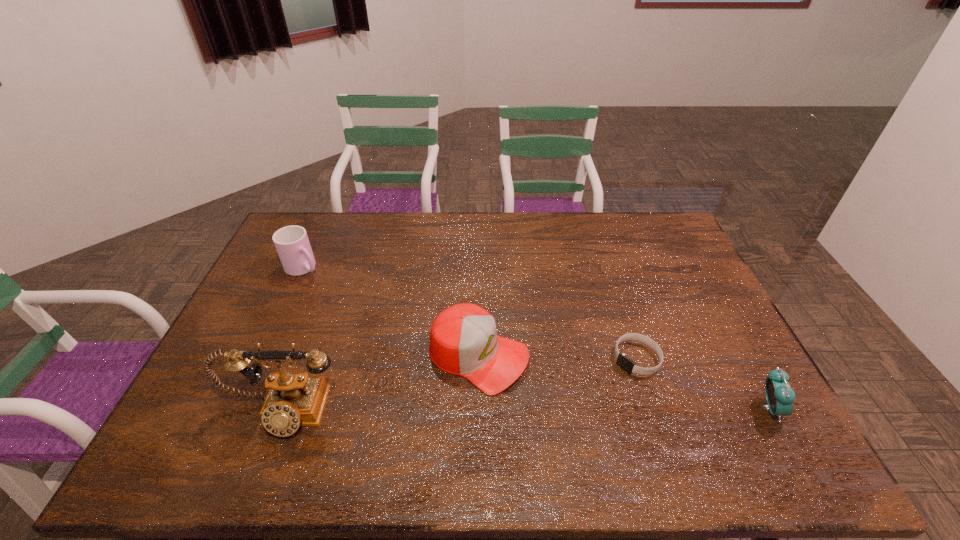
This screenshot has height=540, width=960. I want to click on free space located on the outer surface of the wristband, so click(598, 390).

Identify the location of vacant space located on the outer surface of the wristband. (564, 419).

In order to click on free space located 0.180m on the front-facing side of the baseball cap in this screenshot , I will do `click(587, 409)`.

You are a GUI agent. You are given a task and a screenshot of the screen. Output one action in this format:
    pyautogui.click(x=<x>, y=<y>)
    Task: Click on the vacant space located on the front-facing side of the baseball cap
    
    Given the screenshot: What is the action you would take?
    pyautogui.click(x=598, y=415)

At what (x,y) coordinates should I click in order to perform the action: click on vacant space located 0.220m on the front-facing side of the baseball cap. Please return your answer as a coordinate pair (x, y). The image size is (960, 540). Looking at the image, I should click on (602, 417).

Locate an element on the screen. Image resolution: width=960 pixels, height=540 pixels. telephone present at the near edge is located at coordinates (295, 399).

Where is `alarm clock at the near edge`? Image resolution: width=960 pixels, height=540 pixels. alarm clock at the near edge is located at coordinates (780, 397).

Locate an element on the screen. The image size is (960, 540). baseball cap that is positioned at the near edge is located at coordinates (463, 339).

What are the coordinates of `telephone that is positioned at the left edge` in the screenshot? It's located at (295, 399).

Locate an element on the screen. cup at the left edge is located at coordinates (292, 244).